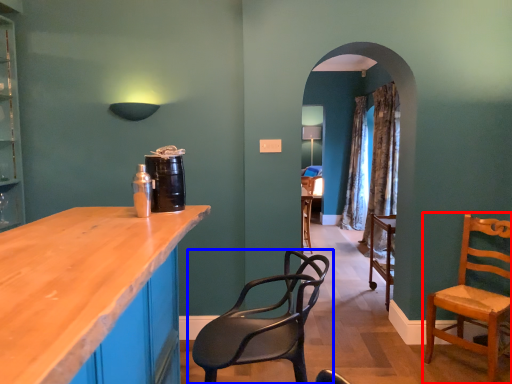
Question: Which object is further to the camera taking this photo, chair (highlighted by a red box) or chair (highlighted by a blue box)?

Choices:
 (A) chair
 (B) chair

Answer: (A)